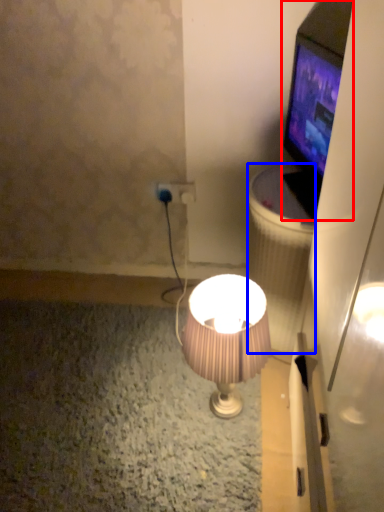
Question: Among these objects, which one is nearest to the camera, television (highlighted by a red box) or trash bin/can (highlighted by a blue box)?

Choices:
 (A) television
 (B) trash bin/can

Answer: (A)